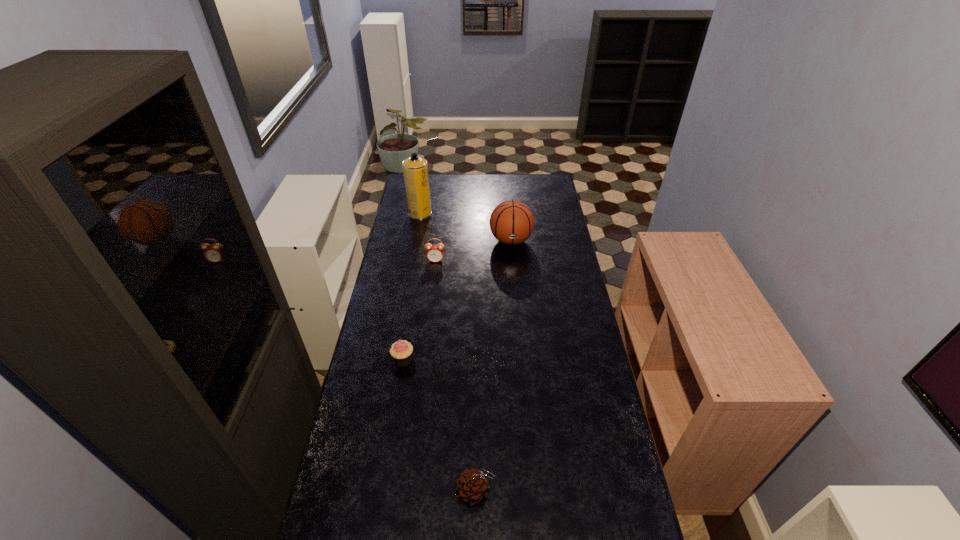
Where is `free spot between the third nearest object and the second farthest object`? This screenshot has width=960, height=540. free spot between the third nearest object and the second farthest object is located at coordinates (473, 251).

The height and width of the screenshot is (540, 960). Identify the location of free space between the second nearest object and the fourth shortest object. (457, 300).

Where is `unoccupied area between the cupcake and the pinecone`? The width and height of the screenshot is (960, 540). unoccupied area between the cupcake and the pinecone is located at coordinates (440, 426).

At what (x,y) coordinates should I click in order to perform the action: click on vacant point located between the fourth farthest object and the aerosol can. Please return your answer as a coordinate pair (x, y). Looking at the image, I should click on (412, 287).

The width and height of the screenshot is (960, 540). I want to click on free spot between the pinecone and the fourth shortest object, so click(x=493, y=366).

Where is `free area in between the nearest object and the fourth farthest object`? The image size is (960, 540). free area in between the nearest object and the fourth farthest object is located at coordinates (440, 426).

Find the location of a particular element. This screenshot has height=540, width=960. object that ranks as the third closest to the pinecone is located at coordinates (512, 222).

Select which object appears as the fourth closest to the third nearest object. Please provide its 2D coordinates. Your answer should be formatted as a tuple, i.e. [(x, y)], where the tuple contains the x and y coordinates of a point satisfying the conditions above.

[(472, 486)]

The width and height of the screenshot is (960, 540). In order to click on blank space that satisfies the following two spatial constraints: 1. on the side where the inflation valve is located; 2. with a leaf charm attached to the pinecone in this screenshot , I will do `click(533, 491)`.

Locate an element on the screen. This screenshot has width=960, height=540. free space in the image that satisfies the following two spatial constraints: 1. on the front side of the fourth farthest object; 2. on the right side of the farthest object is located at coordinates (394, 360).